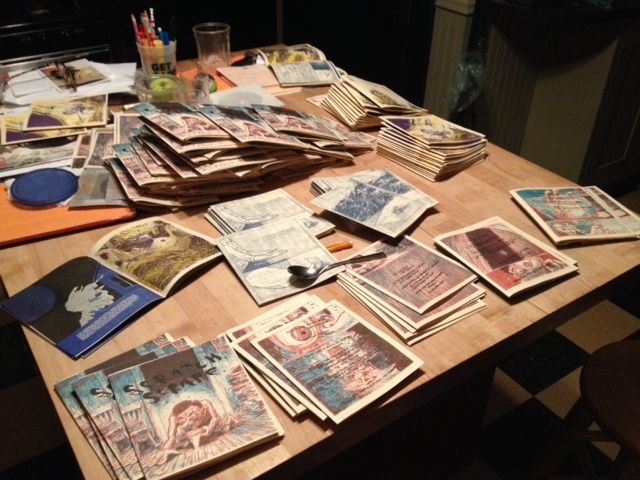
The height and width of the screenshot is (480, 640). Identify the location of spoon. (305, 275).